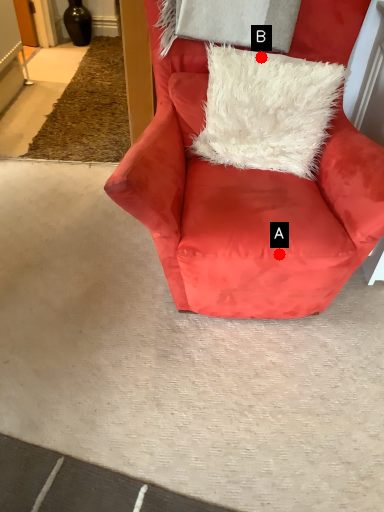
Question: Two points are circled on the image, labeled by A and B beside each circle. Which point is closer to the camera?

Choices:
 (A) A is closer
 (B) B is closer

Answer: (A)